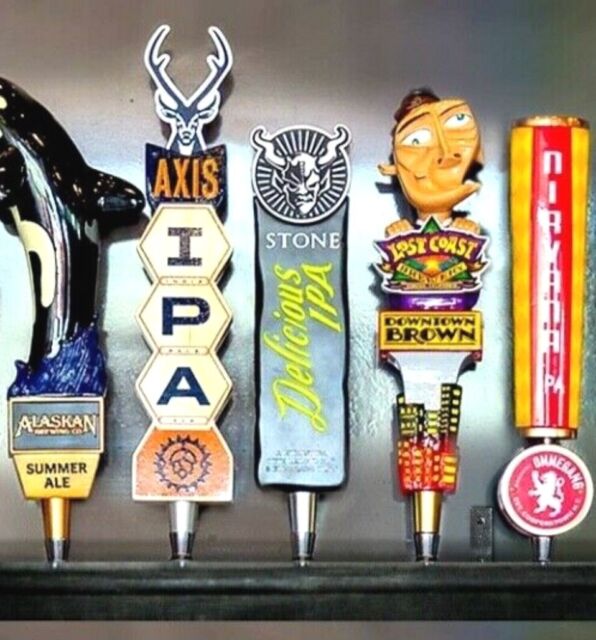
Identify the location of beer tap handles. Image resolution: width=596 pixels, height=640 pixels. (91, 380), (189, 390), (288, 385), (436, 354), (542, 347).